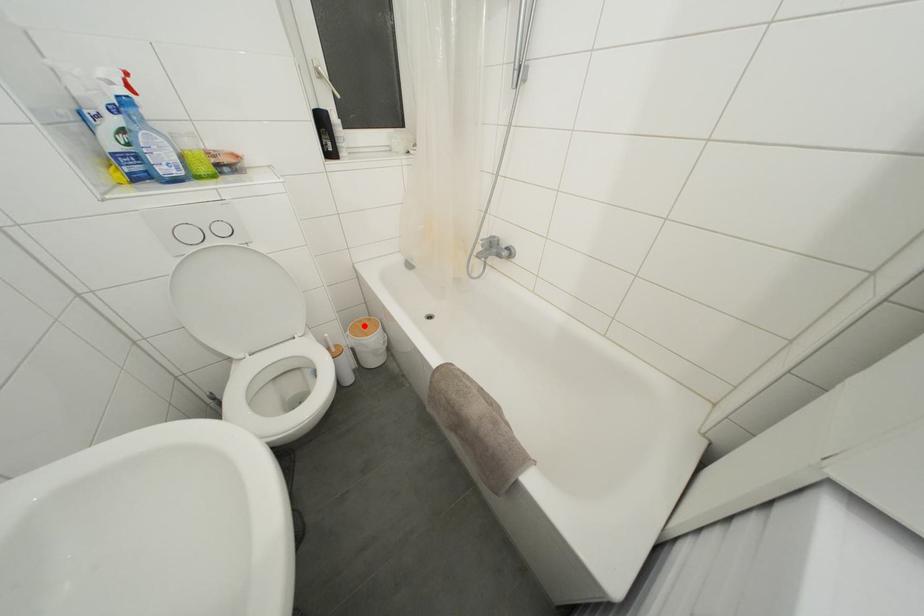
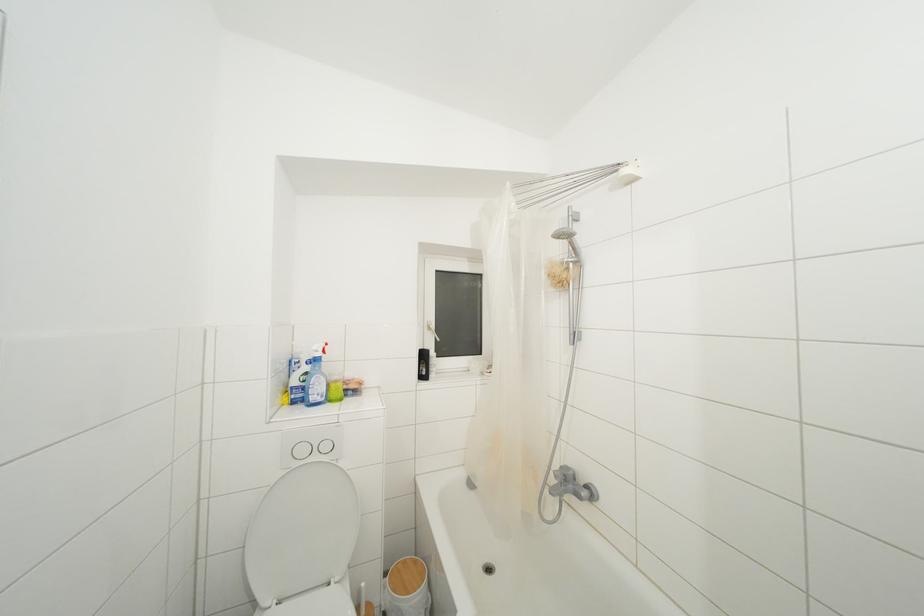
The point at the highlighted location is marked in the first image. Where is the corresponding point in the second image?

(408, 567)